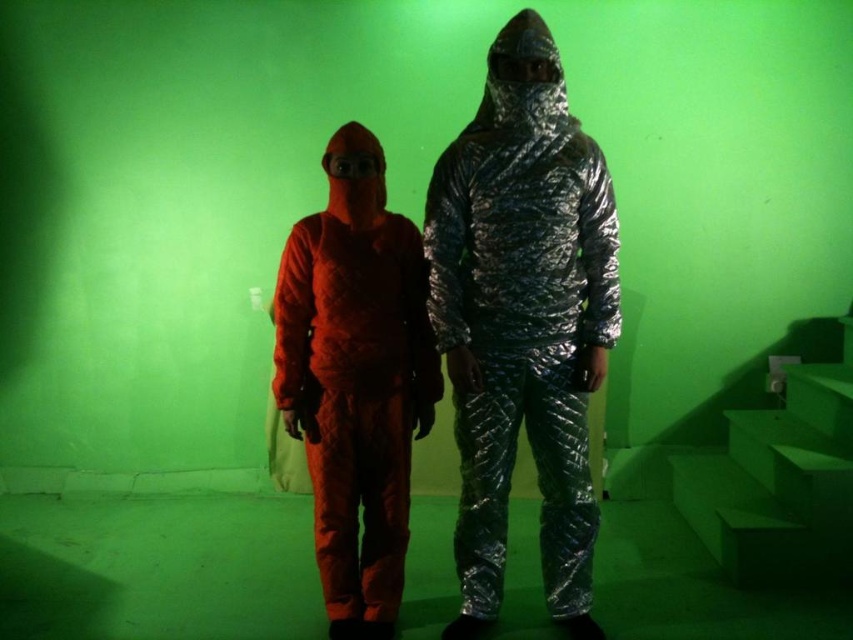
Question: Which object appears farthest from the camera in this image?

Choices:
 (A) shiny metallic suit at center
 (B) matte orange jumpsuit at center

Answer: (B)

Question: Is shiny metallic suit at center positioned in front of matte orange jumpsuit at center?

Choices:
 (A) yes
 (B) no

Answer: (A)

Question: Is shiny metallic suit at center in front of matte orange jumpsuit at center?

Choices:
 (A) yes
 (B) no

Answer: (A)

Question: Can you confirm if shiny metallic suit at center is positioned to the left of matte orange jumpsuit at center?

Choices:
 (A) no
 (B) yes

Answer: (A)